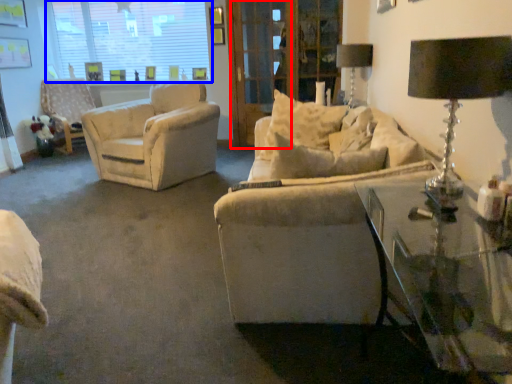
Question: Which point is further to the camera, screen door (highlighted by a red box) or window (highlighted by a blue box)?

Choices:
 (A) screen door
 (B) window

Answer: (B)